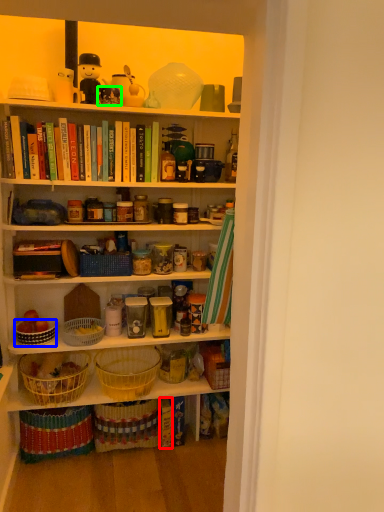
Question: Estimate the real-world distances between objects in this image. Which object is farther from book (highlighted by a red box), bowl (highlighted by a blue box) or toy (highlighted by a green box)?

Choices:
 (A) bowl
 (B) toy

Answer: (B)